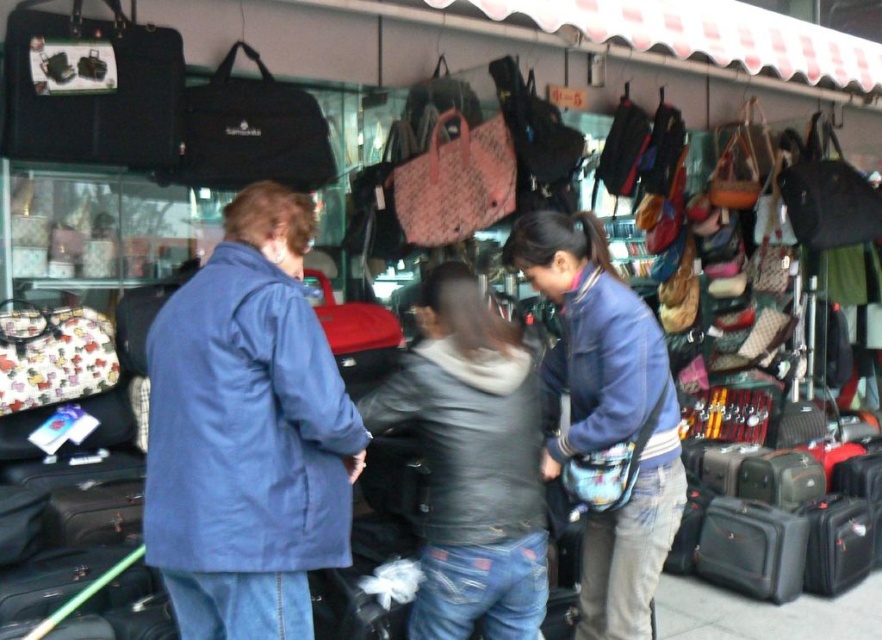
Question: Which object is closer to the camera taking this photo?

Choices:
 (A) matte black briefcase at upper left
 (B) black fabric bag at upper center
 (C) floral fabric purse at center
 (D) leather handbag at center

Answer: (C)

Question: Which is farther from the matte black briefcase at upper left?

Choices:
 (A) matte black bag at upper right
 (B) denim jacket at center
 (C) pink woven tote at center
 (D) blue matte jacket at center

Answer: (A)

Question: Can you confirm if matte black briefcase at upper left is wider than matte black bag at upper right?

Choices:
 (A) no
 (B) yes

Answer: (A)

Question: Can you confirm if black fabric bag at upper center is positioned to the left of pink woven tote at center?

Choices:
 (A) yes
 (B) no

Answer: (A)

Question: Considering the real-world distances, which object is farthest from the black fabric bag at upper center?

Choices:
 (A) leather handbag at center
 (B) matte black briefcase at upper left

Answer: (A)

Question: Is matte black briefcase at upper left wider than pink woven tote at center?

Choices:
 (A) yes
 (B) no

Answer: (A)